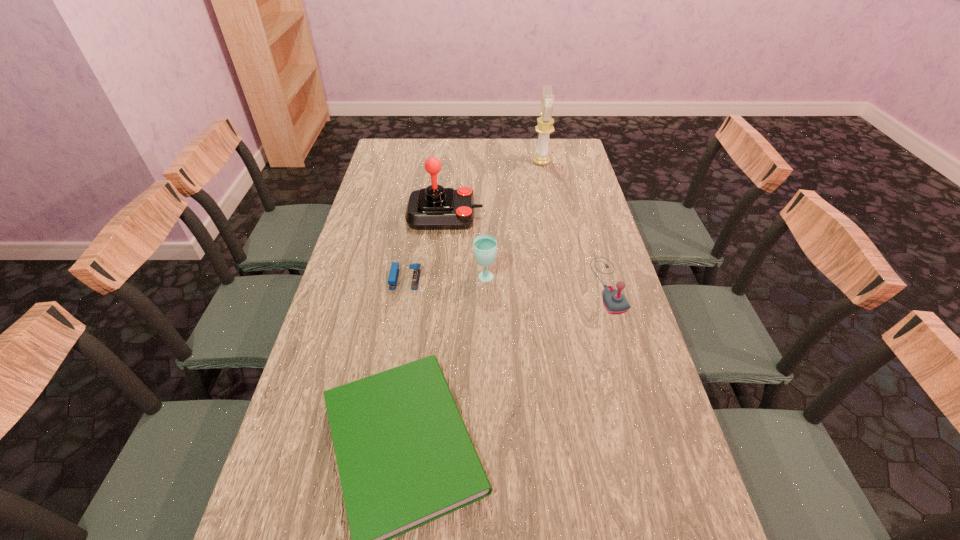
Image resolution: width=960 pixels, height=540 pixels. Find the location of `empty space that is in between the farthest object and the shorter joystick`. empty space that is in between the farthest object and the shorter joystick is located at coordinates (575, 224).

Locate which object ranks fifth in proximity to the glass. Please provide its 2D coordinates. Your answer should be formatted as a tuple, i.e. [(x, y)], where the tuple contains the x and y coordinates of a point satisfying the conditions above.

[(545, 123)]

Locate an element on the screen. The height and width of the screenshot is (540, 960). object that is the second closest to the fifth tallest object is located at coordinates click(x=433, y=208).

Locate an element on the screen. The width and height of the screenshot is (960, 540). vacant area in the image that satisfies the following two spatial constraints: 1. on the base of the third tallest object; 2. on the left side of the second farthest object is located at coordinates (439, 278).

Image resolution: width=960 pixels, height=540 pixels. I want to click on free space that satisfies the following two spatial constraints: 1. on the base of the farther joystick; 2. on the back side of the rightmost object, so click(439, 285).

Locate an element on the screen. free spot that satisfies the following two spatial constraints: 1. on the front-facing side of the shorter joystick; 2. on the left side of the award is located at coordinates (565, 285).

Locate an element on the screen. This screenshot has width=960, height=540. vacant region that satisfies the following two spatial constraints: 1. on the base of the right joystick; 2. on the left side of the left joystick is located at coordinates (439, 285).

What are the coordinates of `free space in the image that satisfies the following two spatial constraints: 1. on the back side of the right joystick; 2. on the front-facing side of the tallest object` in the screenshot? It's located at (572, 162).

Where is `vacant position in the image that satisfies the following two spatial constraints: 1. on the front-facing side of the award; 2. on the front side of the fourth shortest object`? This screenshot has width=960, height=540. vacant position in the image that satisfies the following two spatial constraints: 1. on the front-facing side of the award; 2. on the front side of the fourth shortest object is located at coordinates (564, 278).

Locate an element on the screen. Image resolution: width=960 pixels, height=540 pixels. free point that satisfies the following two spatial constraints: 1. on the base of the taller joystick; 2. on the front side of the stapler is located at coordinates (439, 279).